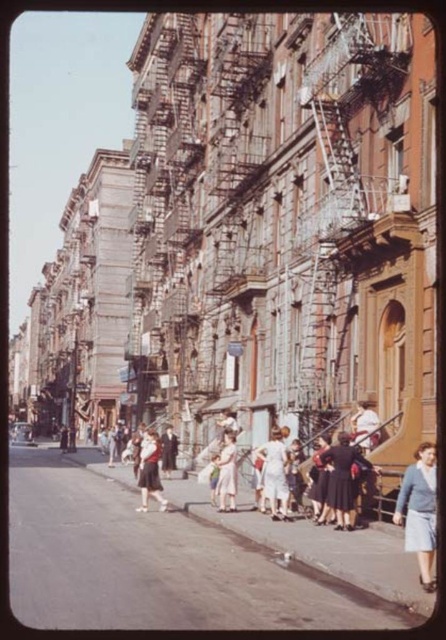
Question: Which point is farther from the camera taking this photo?

Choices:
 (A) (342, 504)
 (B) (148, 456)

Answer: (B)

Question: Considering the relative positions of dark fabric dress at center and light pink dress at center in the image provided, where is dark fabric dress at center located with respect to light pink dress at center?

Choices:
 (A) above
 (B) below

Answer: (A)

Question: Can you confirm if light blue fabric dress at lower right is positioned above dark fabric dress at center?

Choices:
 (A) no
 (B) yes

Answer: (A)

Question: Is matte black dress at center above light pink dress at center?

Choices:
 (A) yes
 (B) no

Answer: (B)

Question: Which object is closer to the camera taking this photo?

Choices:
 (A) light pink dress at center
 (B) matte black dress at center

Answer: (A)

Question: Which object is positioned closest to the light pink dress at center?

Choices:
 (A) light blue fabric dress at lower right
 (B) white cotton dress at center
 (C) matte black dress at center

Answer: (B)